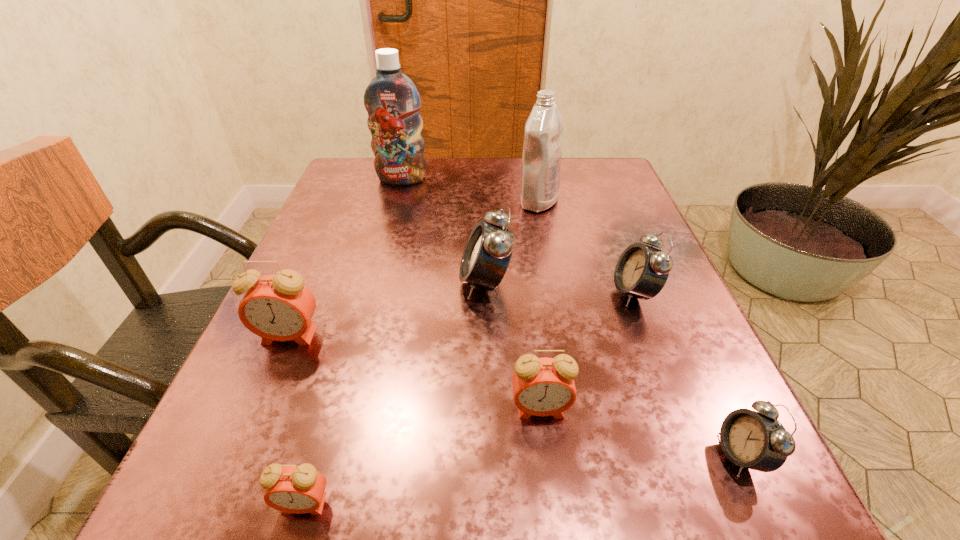
I want to click on free region located 0.380m on the face of the second biggest white alarm clock, so click(396, 293).

Where is `vacant space located 0.250m on the face of the second biggest white alarm clock`? Image resolution: width=960 pixels, height=540 pixels. vacant space located 0.250m on the face of the second biggest white alarm clock is located at coordinates (470, 293).

Locate an element on the screen. This screenshot has height=540, width=960. free space located 0.130m on the face of the second biggest white alarm clock is located at coordinates (539, 293).

This screenshot has width=960, height=540. I want to click on free space located on the face of the rightmost pink alarm clock, so click(x=555, y=527).

The height and width of the screenshot is (540, 960). What are the coordinates of `free point located on the face of the nearest white alarm clock` in the screenshot? It's located at (647, 455).

Where is `free space located on the face of the nearest white alarm clock`? free space located on the face of the nearest white alarm clock is located at coordinates (631, 455).

Identify the location of vacant position located 0.330m on the face of the nearest white alarm clock. (454, 455).

This screenshot has width=960, height=540. I want to click on shampoo positioned at the far edge, so click(392, 101).

Identify the location of detergent that is at the far edge. (543, 136).

The image size is (960, 540). Find the location of `shampoo that is at the left edge`. shampoo that is at the left edge is located at coordinates (392, 101).